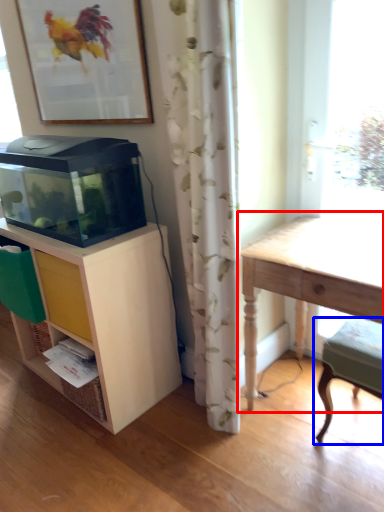
Question: Which object appears closest to the camera in this image, table (highlighted by a red box) or step stool (highlighted by a blue box)?

Choices:
 (A) table
 (B) step stool

Answer: (A)